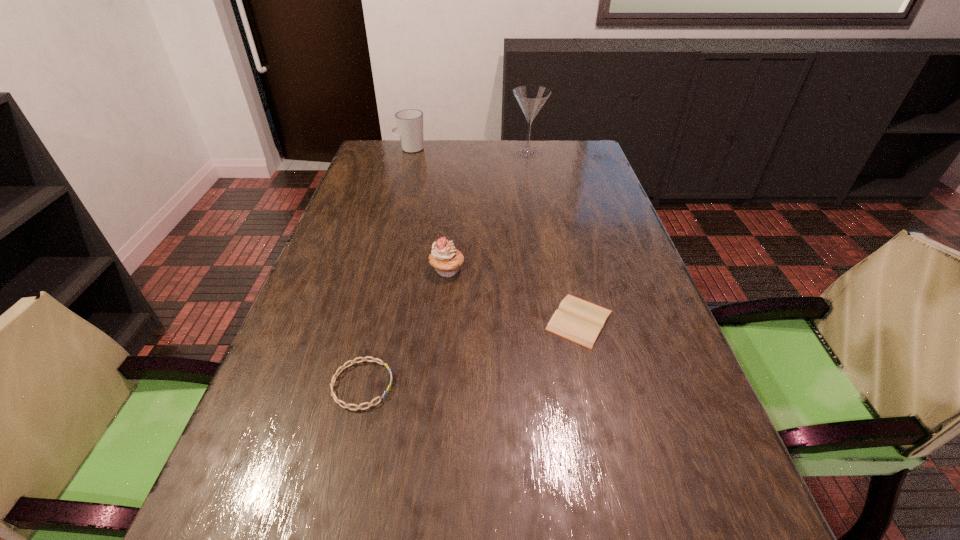
Where is `object that is the closest to the fourth farthest object`? This screenshot has width=960, height=540. object that is the closest to the fourth farthest object is located at coordinates (445, 258).

I want to click on vacant position in the image that satisfies the following two spatial constraints: 1. with a handle on the side of the cup; 2. on the left side of the third shortest object, so click(x=377, y=270).

You are a GUI agent. You are given a task and a screenshot of the screen. Output one action in this format:
    pyautogui.click(x=<x>, y=<y>)
    Task: Click on the free space that satisfies the following two spatial constraints: 1. on the front side of the diary; 2. on the left side of the third nearest object
    This screenshot has width=960, height=540.
    Given the screenshot: What is the action you would take?
    pyautogui.click(x=443, y=320)

Locate an element on the screen. This screenshot has width=960, height=540. free space that satisfies the following two spatial constraints: 1. with a handle on the side of the flute glass; 2. on the right side of the cup is located at coordinates (409, 152).

Identify the location of vacant space that satisfies the following two spatial constraints: 1. on the back side of the third object from right to left; 2. on the left side of the flute glass. (457, 152).

Locate an element on the screen. vacant area in the image that satisfies the following two spatial constraints: 1. on the back side of the tallest object; 2. on the left side of the third object from right to left is located at coordinates (457, 152).

Locate an element on the screen. vacant space that satisfies the following two spatial constraints: 1. on the back side of the tallest object; 2. on the left side of the third shortest object is located at coordinates (457, 152).

Identify the location of vacant area in the image that satisfies the following two spatial constraints: 1. on the back side of the third tallest object; 2. with a handle on the side of the second tallest object. The width and height of the screenshot is (960, 540). pos(458,148).

You are a GUI agent. You are given a task and a screenshot of the screen. Output one action in this format:
    pyautogui.click(x=<x>, y=<y>)
    Task: Click on the free space that satisfies the following two spatial constraints: 1. with a handle on the side of the second tallest object; 2. on the back side of the second nearest object
    Image resolution: width=960 pixels, height=540 pixels.
    Given the screenshot: What is the action you would take?
    pyautogui.click(x=364, y=320)

This screenshot has width=960, height=540. I want to click on free region that satisfies the following two spatial constraints: 1. with a handle on the side of the fourth shortest object; 2. on the right side of the fourth farthest object, so click(364, 320).